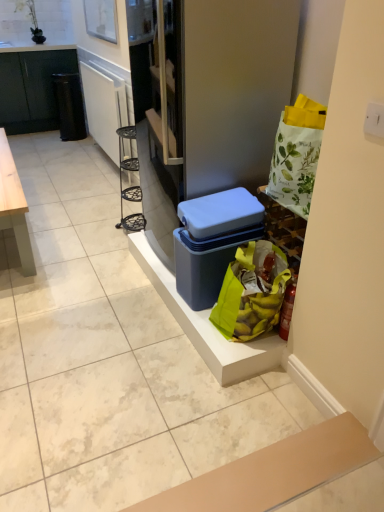
Question: From a real-world perspective, is blue plastic storage box at center over black matte cabinet at left?

Choices:
 (A) yes
 (B) no

Answer: (B)

Question: Does blue plastic storage box at center have a larger size compared to black matte cabinet at left?

Choices:
 (A) yes
 (B) no

Answer: (B)

Question: Considering the relative sizes of blue plastic storage box at center and black matte cabinet at left in the image provided, is blue plastic storage box at center smaller than black matte cabinet at left?

Choices:
 (A) yes
 (B) no

Answer: (A)

Question: Are blue plastic storage box at center and black matte cabinet at left far apart?

Choices:
 (A) yes
 (B) no

Answer: (A)

Question: Does blue plastic storage box at center lie in front of black matte cabinet at left?

Choices:
 (A) yes
 (B) no

Answer: (A)

Question: Is the depth of blue plastic storage box at center greater than that of black matte cabinet at left?

Choices:
 (A) no
 (B) yes

Answer: (A)

Question: From a real-world perspective, is black plastic trash can at left located higher than black matte cabinet at left?

Choices:
 (A) yes
 (B) no

Answer: (B)

Question: From the image's perspective, is black plastic trash can at left below black matte cabinet at left?

Choices:
 (A) no
 (B) yes

Answer: (B)

Question: Does black plastic trash can at left have a smaller size compared to black matte cabinet at left?

Choices:
 (A) yes
 (B) no

Answer: (A)

Question: Is black plastic trash can at left to the right of black matte cabinet at left from the viewer's perspective?

Choices:
 (A) yes
 (B) no

Answer: (A)

Question: Is black plastic trash can at left positioned behind black matte cabinet at left?

Choices:
 (A) no
 (B) yes

Answer: (A)

Question: Considering the relative positions of black plastic trash can at left and black matte cabinet at left in the image provided, is black plastic trash can at left in front of black matte cabinet at left?

Choices:
 (A) yes
 (B) no

Answer: (A)

Question: Considering the relative positions of banana-patterned fabric bag at lower right and black matte cabinet at left in the image provided, is banana-patterned fabric bag at lower right to the left of black matte cabinet at left from the viewer's perspective?

Choices:
 (A) no
 (B) yes

Answer: (A)